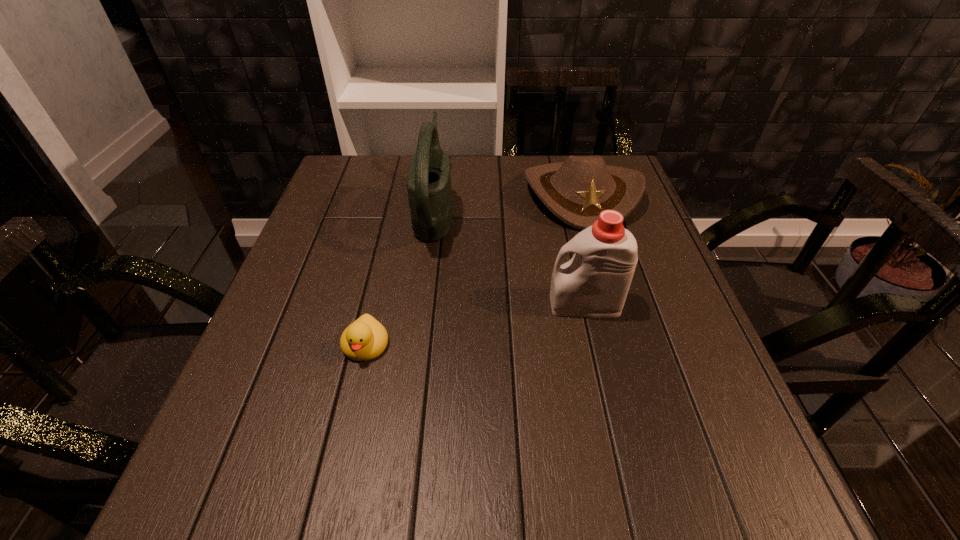
The height and width of the screenshot is (540, 960). Find the location of `free location that satisfies the following two spatial constraints: 1. with a star on the front of the third tallest object; 2. on the spout of the watering can`. free location that satisfies the following two spatial constraints: 1. with a star on the front of the third tallest object; 2. on the spout of the watering can is located at coordinates (586, 209).